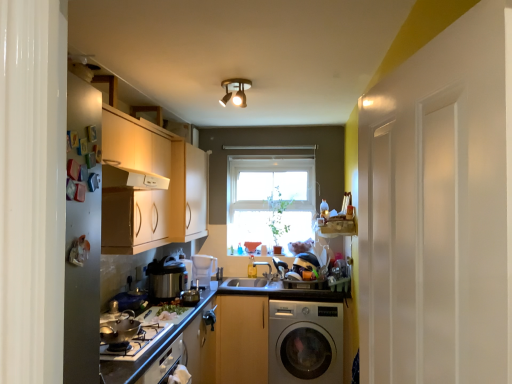
Question: Is silver metallic washing machine at lower right taller or shorter than clear glass window at center?

Choices:
 (A) tall
 (B) short

Answer: (B)

Question: Looking at the image, does silver metallic washing machine at lower right seem bigger or smaller compared to clear glass window at center?

Choices:
 (A) big
 (B) small

Answer: (A)

Question: Which is nearer to the metallic pressure cooker at center?

Choices:
 (A) gold metallic spotlight at center
 (B) white plastic pitcher at center, which is the second appliance in front-to-back order
 (C) silver metallic gas stove at lower left
 (D) clear glass window at center
 (E) wooden cabinet at center, acting as the second cabinetry starting from the top

Answer: (B)

Question: Considering the real-world distances, which object is farthest from the metallic pressure cooker at center?

Choices:
 (A) clear glass window at center
 (B) smooth granite countertop at center
 (C) silver metallic washing machine at lower right
 (D) white plastic pitcher at center, positioned as the 1th appliance in right-to-left order
 (E) matte white countertop at lower left

Answer: (A)